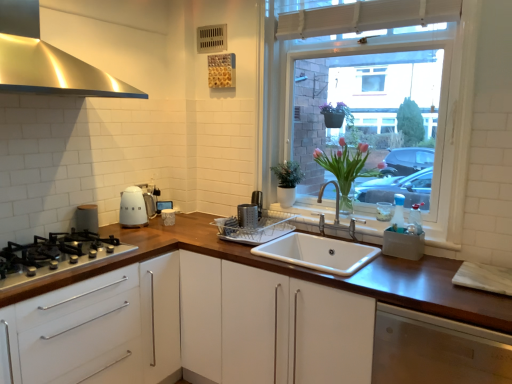
This screenshot has width=512, height=384. I want to click on free space in front of silver metallic grater at center, which ranks as the 1th appliance in right-to-left order, so click(244, 245).